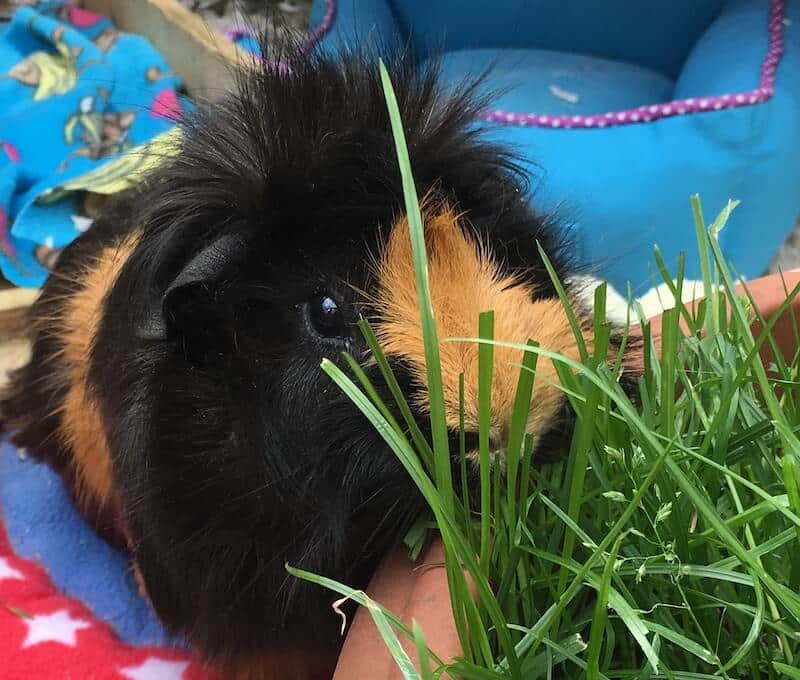
Identify the location of planter pot. The height and width of the screenshot is (680, 800). (437, 604).